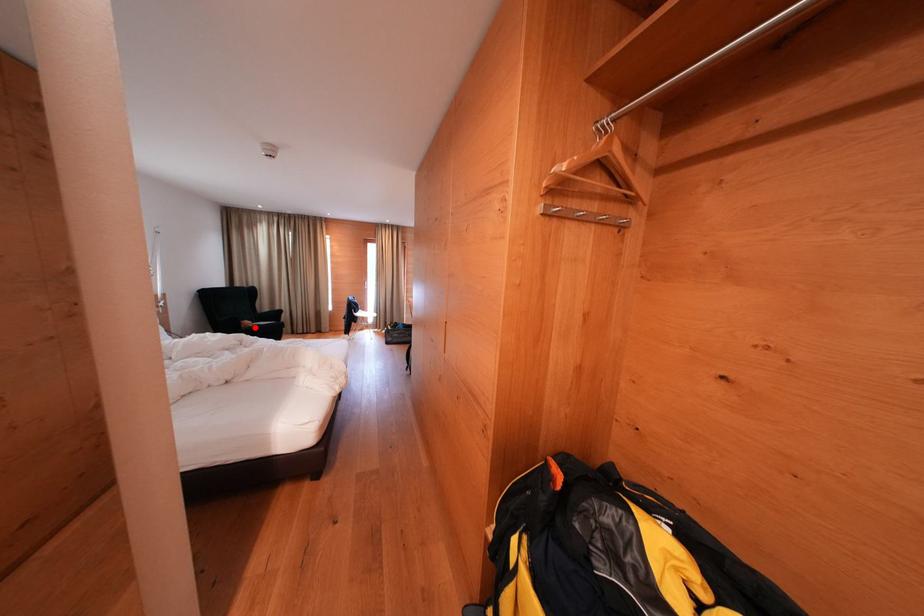
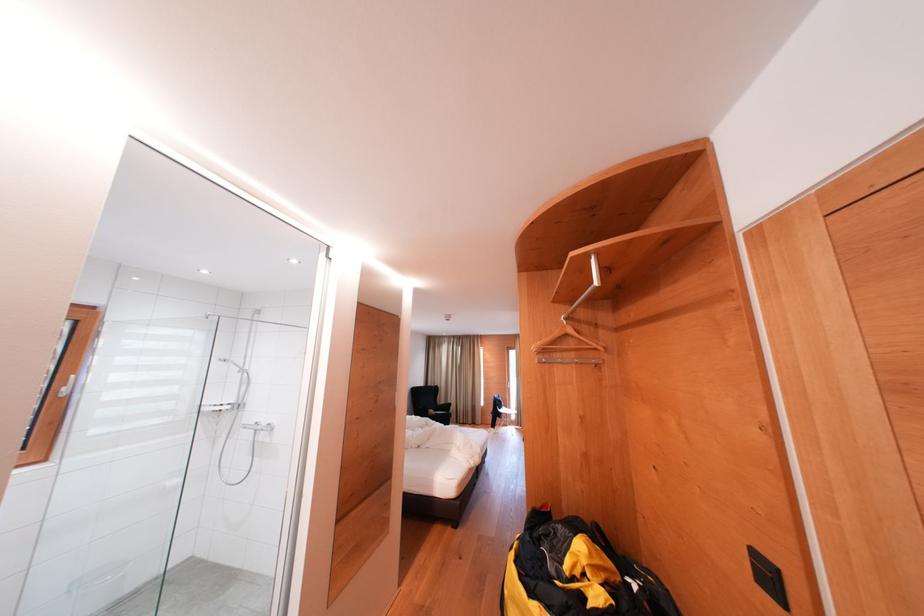
Question: I am providing you with two images of the same scene from different viewpoints. Image1 has a red point marked. In image2, the corresponding 3D location appears at what relative position? Reply with the corresponding letter.

Choices:
 (A) Closer
 (B) Farther

Answer: (B)